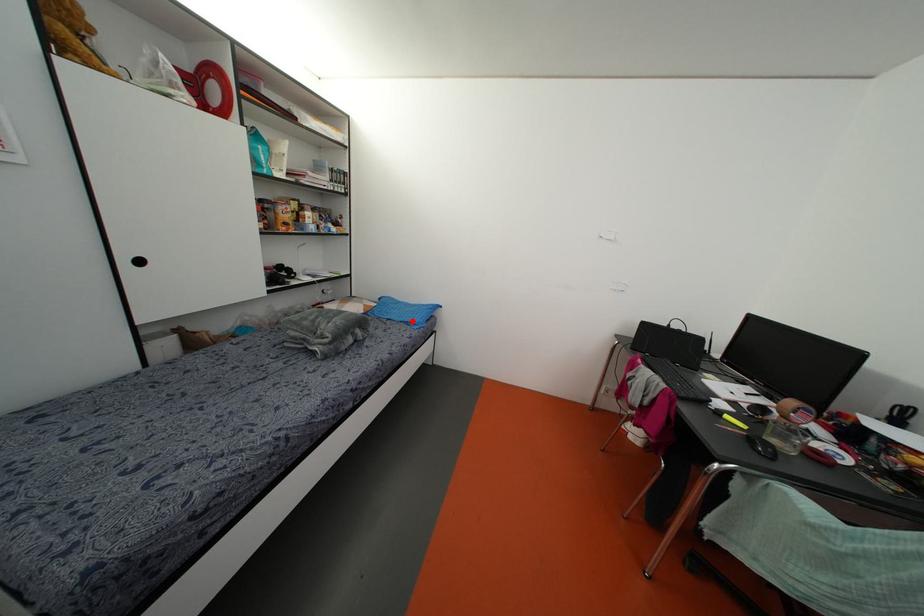
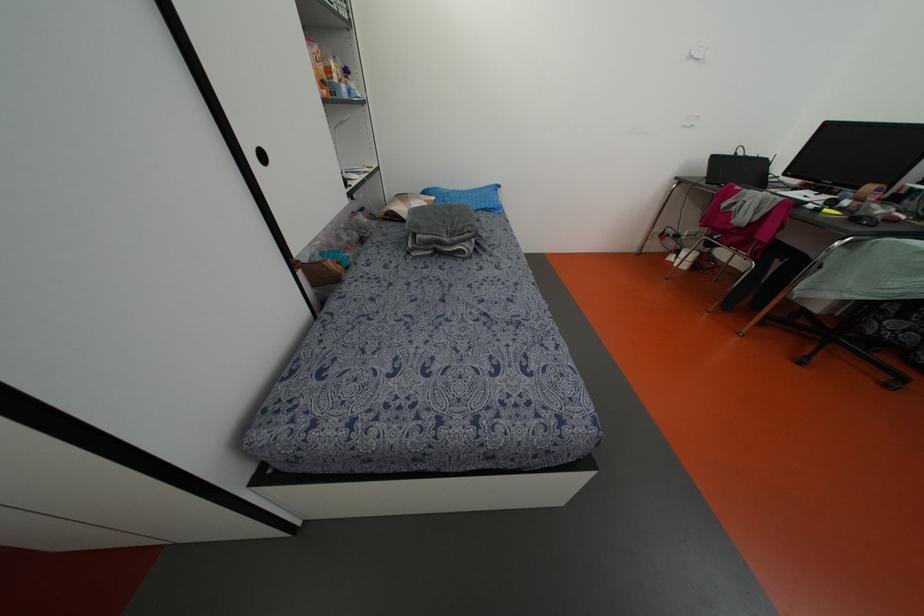
In the second image, find the point that corresponds to the highlighted location in the first image.

(492, 206)